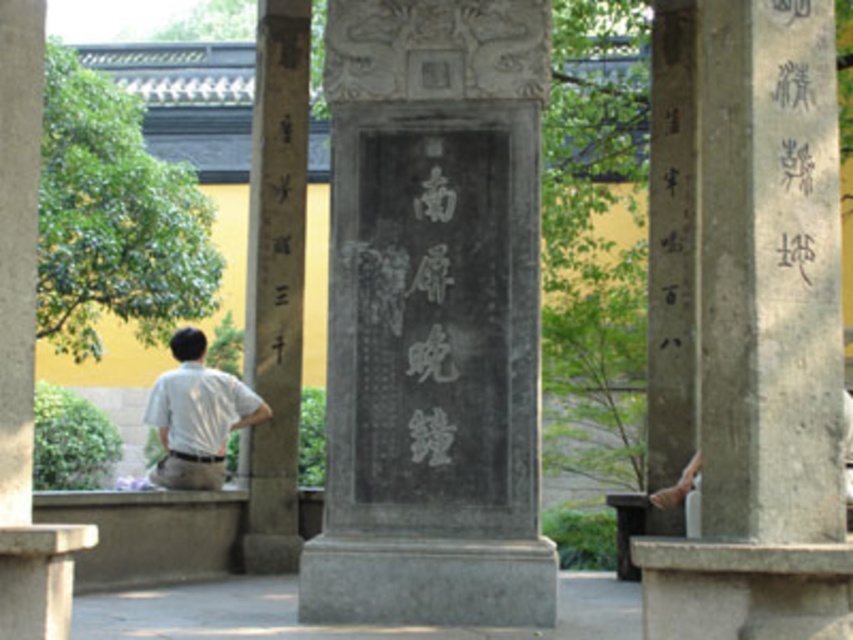
You are standing in a traditional Chinese garden and want to take a photo of the large stone monument. The camera you are using has a maximum focus range of 85 feet. Is the point at coordinates point (701, 72) within the camera focus range?

The point at point (701, 72) is 87.39 feet away from the camera, which exceeds the maximum focus range of 85 feet. Therefore, the camera cannot focus on that point.

You are a visitor in this garden and want to take a photo of both the gray stone pillar at right and the white shirt at left. Since you want to include both in the frame, which object should you focus on to ensure both are visible?

You should focus on the white shirt at left because it occupies more space and will be easier to frame alongside the gray stone pillar at right.